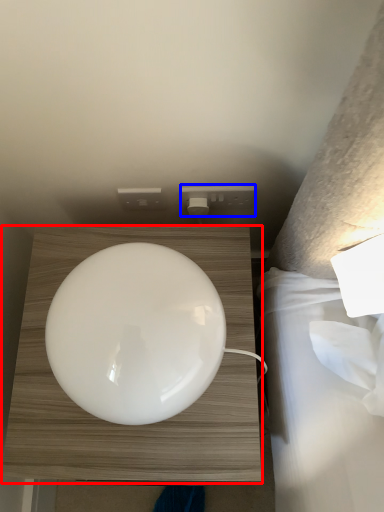
Question: Among these objects, which one is farthest to the camera, furniture (highlighted by a red box) or electric outlet (highlighted by a blue box)?

Choices:
 (A) furniture
 (B) electric outlet

Answer: (B)